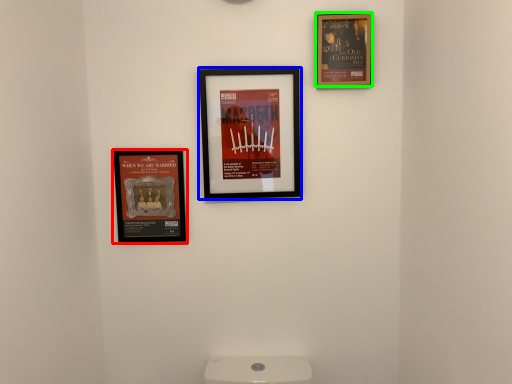
Question: Considering the real-world distances, which object is closest to picture frame (highlighted by a red box)? picture frame (highlighted by a blue box) or picture frame (highlighted by a green box).

Choices:
 (A) picture frame
 (B) picture frame

Answer: (A)